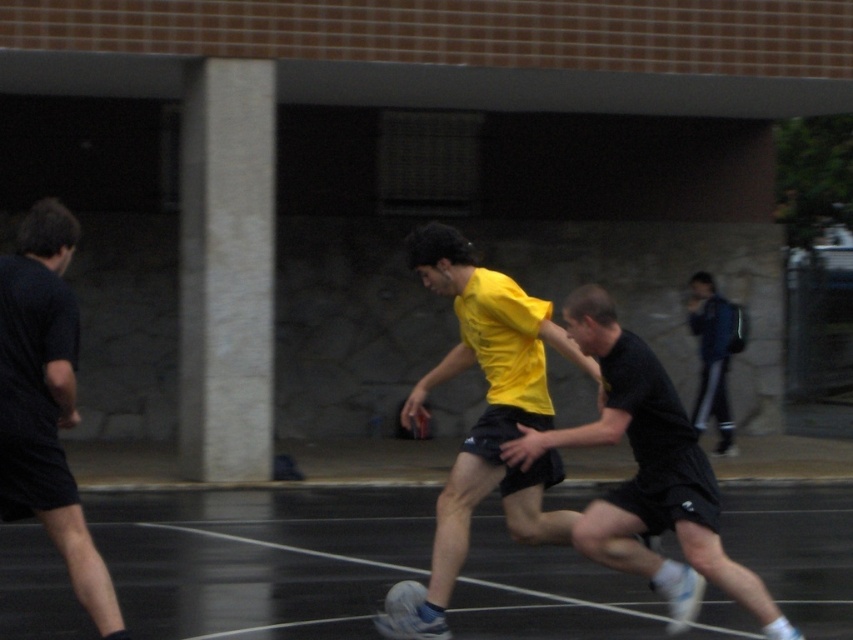
You are a soccer referee watching the match. You notice the yellow matte shirt at center and the black matte shorts at left. Which one is positioned lower on the field?

The yellow matte shirt at center is positioned lower on the field compared to the black matte shorts at left because the description states that the yellow matte shirt at center is below the black matte shorts at left.

In the scene shown: You are a soccer coach analyzing the players on the field. You notice the yellow matte shirt at center and the black textured shorts at center. Which of these two items is taller?

The yellow matte shirt at center is taller than the black textured shorts at center.

You are a soccer coach analyzing the match. You notice the yellow matte shirt at center and the black matte shorts at left. Which object appears bigger in the image?

The yellow matte shirt at center appears larger in size than the black matte shorts at left.